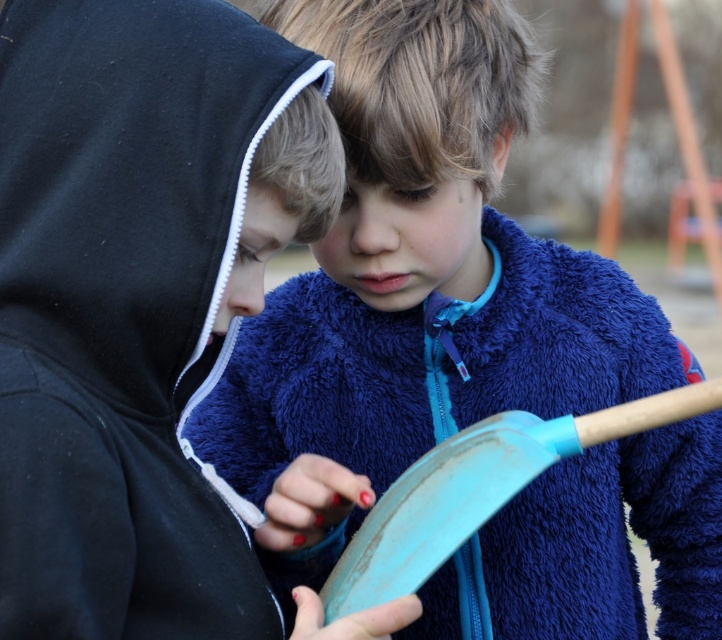
Consider the image. Can you confirm if blue fuzzy sweater at center is wider than teal plastic shovel at center?

Indeed, blue fuzzy sweater at center has a greater width compared to teal plastic shovel at center.

In the scene shown: Does blue fuzzy sweater at center come behind teal plastic shovel at center?

Yes, it is.

Who is more forward, (490,211) or (465,504)?

Point (465,504) is more forward.

Where is `blue fuzzy sweater at center`? blue fuzzy sweater at center is located at coordinates coord(417,284).